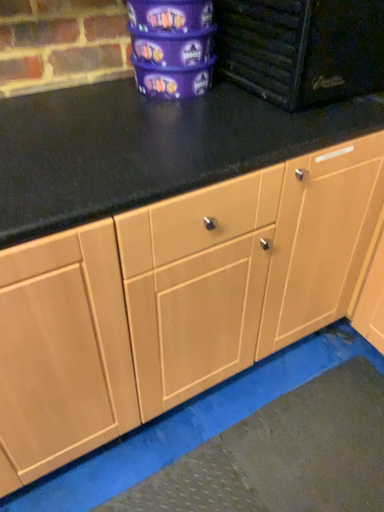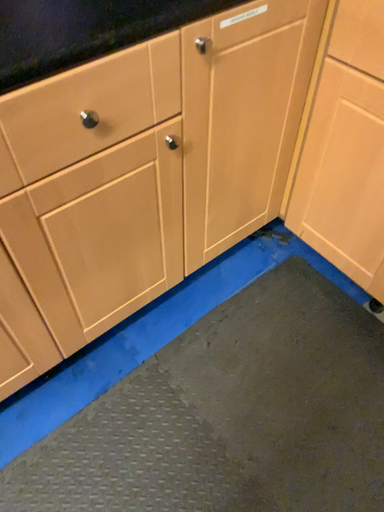
Question: How did the camera likely rotate when shooting the video?

Choices:
 (A) rotated upward
 (B) rotated downward

Answer: (B)